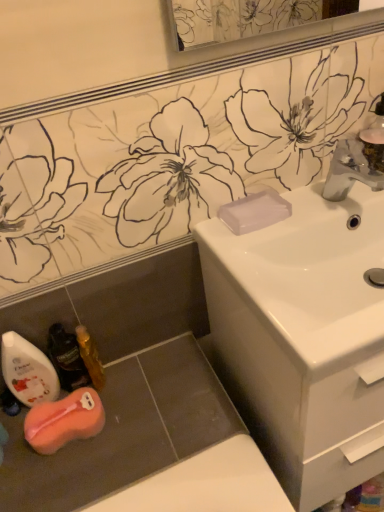
Locate an element on the screen. orange sponge at lower left is located at coordinates (64, 421).

Measure the distance between point (350, 185) and camera.

A distance of 35.08 inches exists between point (350, 185) and camera.

Describe the element at coordinates (90, 357) in the screenshot. This screenshot has width=384, height=512. I see `gold metallic mouthwash at lower left, which ranks as the first mouthwash in right-to-left order` at that location.

This screenshot has width=384, height=512. What do you see at coordinates (255, 211) in the screenshot?
I see `transparent plastic soap at sink right` at bounding box center [255, 211].

The image size is (384, 512). Describe the element at coordinates (67, 358) in the screenshot. I see `translucent plastic mouthwash at lower left, marked as the 2th mouthwash in a left-to-right arrangement` at that location.

In order to click on translucent plastic mouthwash at lower left, marked as the 2th mouthwash in a left-to-right arrangement in this screenshot , I will do `click(67, 358)`.

What are the coordinates of `orange sponge at lower left` in the screenshot? It's located at (64, 421).

In the scene shown: Are satin nickel faucet at upper right and orange sponge at lower left making contact?

No, satin nickel faucet at upper right is not beside orange sponge at lower left.

Would you say satin nickel faucet at upper right is inside or outside orange sponge at lower left?

satin nickel faucet at upper right cannot be found inside orange sponge at lower left.

Which object is further away from the camera, satin nickel faucet at upper right or orange sponge at lower left?

orange sponge at lower left is more distant.

Consider the image. Is gold metallic mouthwash at lower left, which is counted as the third mouthwash, starting from the left, inside the boundaries of white glossy sink at center, or outside?

gold metallic mouthwash at lower left, which is counted as the third mouthwash, starting from the left, is not inside white glossy sink at center, it's outside.

Is gold metallic mouthwash at lower left, which ranks as the first mouthwash in right-to-left order, oriented towards white glossy sink at center?

No, gold metallic mouthwash at lower left, which ranks as the first mouthwash in right-to-left order, does not turn towards white glossy sink at center.

Is gold metallic mouthwash at lower left, which is counted as the third mouthwash, starting from the left, further to camera compared to white glossy sink at center?

Yes.

Which is more to the right, orange sponge at lower left or transparent plastic soap at sink right?

transparent plastic soap at sink right is more to the right.

Between orange sponge at lower left and transparent plastic soap at sink right, which one has less height?

transparent plastic soap at sink right.

Is orange sponge at lower left wider than transparent plastic soap at sink right?

Yes.

From a real-world perspective, between white glossy mouthwash at lower left, the third mouthwash positioned from the right, and white glossy sink at center, who is vertically higher?

white glossy mouthwash at lower left, the third mouthwash positioned from the right, is physically above.

Looking at this image, in the image, is white glossy mouthwash at lower left, the third mouthwash positioned from the right, positioned in front of or behind white glossy sink at center?

In the image, white glossy mouthwash at lower left, the third mouthwash positioned from the right, appears behind white glossy sink at center.

Which of these two, white glossy mouthwash at lower left, the 1th mouthwash positioned from the left, or white glossy sink at center, is bigger?

white glossy sink at center is bigger.

Identify the location of mouthwash that is the 2nd one when counting backward from the satin nickel faucet at upper right. click(67, 358).

Relative to satin nickel faucet at upper right, is translucent plastic mouthwash at lower left, positioned as the 2th mouthwash in right-to-left order, in front or behind?

Clearly, translucent plastic mouthwash at lower left, positioned as the 2th mouthwash in right-to-left order, is behind satin nickel faucet at upper right.

Considering the sizes of objects translucent plastic mouthwash at lower left, positioned as the 2th mouthwash in right-to-left order, and satin nickel faucet at upper right in the image provided, who is wider, translucent plastic mouthwash at lower left, positioned as the 2th mouthwash in right-to-left order, or satin nickel faucet at upper right?

satin nickel faucet at upper right.

Based on the photo, who is shorter, gold metallic mouthwash at lower left, which ranks as the first mouthwash in right-to-left order, or translucent plastic mouthwash at lower left, marked as the 2th mouthwash in a left-to-right arrangement?

With less height is gold metallic mouthwash at lower left, which ranks as the first mouthwash in right-to-left order.

Where is `mouthwash located above the translucent plastic mouthwash at lower left, marked as the 2th mouthwash in a left-to-right arrangement (from the image's perspective)`? The width and height of the screenshot is (384, 512). mouthwash located above the translucent plastic mouthwash at lower left, marked as the 2th mouthwash in a left-to-right arrangement (from the image's perspective) is located at coordinates (90, 357).

In the scene shown: Can you see gold metallic mouthwash at lower left, which is counted as the third mouthwash, starting from the left, touching translucent plastic mouthwash at lower left, positioned as the 2th mouthwash in right-to-left order?

Yes, gold metallic mouthwash at lower left, which is counted as the third mouthwash, starting from the left, is beside translucent plastic mouthwash at lower left, positioned as the 2th mouthwash in right-to-left order.

Which is behind, point (86, 334) or point (65, 367)?

The point (86, 334) is farther.

Considering the relative sizes of satin nickel faucet at upper right and translucent plastic mouthwash at lower left, marked as the 2th mouthwash in a left-to-right arrangement, in the image provided, is satin nickel faucet at upper right bigger than translucent plastic mouthwash at lower left, marked as the 2th mouthwash in a left-to-right arrangement,?

Yes.

Which object is wider, satin nickel faucet at upper right or translucent plastic mouthwash at lower left, positioned as the 2th mouthwash in right-to-left order?

satin nickel faucet at upper right is wider.

How much distance is there between satin nickel faucet at upper right and translucent plastic mouthwash at lower left, marked as the 2th mouthwash in a left-to-right arrangement?

The distance of satin nickel faucet at upper right from translucent plastic mouthwash at lower left, marked as the 2th mouthwash in a left-to-right arrangement, is 27.08 inches.

Looking at this image, can you confirm if satin nickel faucet at upper right is positioned to the right of translucent plastic mouthwash at lower left, marked as the 2th mouthwash in a left-to-right arrangement?

Yes, satin nickel faucet at upper right is to the right of translucent plastic mouthwash at lower left, marked as the 2th mouthwash in a left-to-right arrangement.

At what (x,y) coordinates should I click in order to perform the action: click on tap in front of the orange sponge at lower left. Please return your answer as a coordinate pair (x, y). Image resolution: width=384 pixels, height=512 pixels. Looking at the image, I should click on (354, 167).

Identify the location of the 3rd mouthwash behind the white glossy sink at center. The height and width of the screenshot is (512, 384). (90, 357).

When comparing their distances from gold metallic mouthwash at lower left, which is counted as the third mouthwash, starting from the left, does satin nickel faucet at upper right or white glossy sink at center seem closer?

Based on the image, white glossy sink at center appears to be nearer to gold metallic mouthwash at lower left, which is counted as the third mouthwash, starting from the left.

When comparing their distances from orange sponge at lower left, does gold metallic mouthwash at lower left, which ranks as the first mouthwash in right-to-left order, or transparent plastic soap at sink right seem closer?

gold metallic mouthwash at lower left, which ranks as the first mouthwash in right-to-left order, lies closer to orange sponge at lower left than the other object.

Looking at the image, which one is located closer to white glossy mouthwash at lower left, the third mouthwash positioned from the right, white glossy sink at center or gold metallic mouthwash at lower left, which ranks as the first mouthwash in right-to-left order?

The object closer to white glossy mouthwash at lower left, the third mouthwash positioned from the right, is gold metallic mouthwash at lower left, which ranks as the first mouthwash in right-to-left order.

Looking at the image, which one is located closer to white glossy sink at center, translucent plastic mouthwash at lower left, marked as the 2th mouthwash in a left-to-right arrangement, or orange sponge at lower left?

The object closer to white glossy sink at center is orange sponge at lower left.

From the image, which object appears to be nearer to white glossy mouthwash at lower left, the third mouthwash positioned from the right, white glossy sink at center or orange sponge at lower left?

orange sponge at lower left.

Looking at the image, which one is located closer to translucent plastic mouthwash at lower left, marked as the 2th mouthwash in a left-to-right arrangement, gold metallic mouthwash at lower left, which is counted as the third mouthwash, starting from the left, or transparent plastic soap at sink right?

gold metallic mouthwash at lower left, which is counted as the third mouthwash, starting from the left, is closer to translucent plastic mouthwash at lower left, marked as the 2th mouthwash in a left-to-right arrangement.

Based on their spatial positions, is translucent plastic mouthwash at lower left, positioned as the 2th mouthwash in right-to-left order, or white glossy mouthwash at lower left, the 1th mouthwash positioned from the left, further from gold metallic mouthwash at lower left, which ranks as the first mouthwash in right-to-left order?

Based on the image, white glossy mouthwash at lower left, the 1th mouthwash positioned from the left, appears to be further to gold metallic mouthwash at lower left, which ranks as the first mouthwash in right-to-left order.

Based on their spatial positions, is white glossy mouthwash at lower left, the 1th mouthwash positioned from the left, or translucent plastic mouthwash at lower left, marked as the 2th mouthwash in a left-to-right arrangement, further from satin nickel faucet at upper right?

Based on the image, white glossy mouthwash at lower left, the 1th mouthwash positioned from the left, appears to be further to satin nickel faucet at upper right.

The width and height of the screenshot is (384, 512). In order to click on mouthwash between translucent plastic mouthwash at lower left, marked as the 2th mouthwash in a left-to-right arrangement, and orange sponge at lower left vertically in this screenshot , I will do `click(27, 371)`.

Where is `mouthwash situated between translucent plastic mouthwash at lower left, marked as the 2th mouthwash in a left-to-right arrangement, and transparent plastic soap at sink right from left to right`? This screenshot has height=512, width=384. mouthwash situated between translucent plastic mouthwash at lower left, marked as the 2th mouthwash in a left-to-right arrangement, and transparent plastic soap at sink right from left to right is located at coordinates (90, 357).

Locate an element on the screen. chiffonier located between translucent plastic mouthwash at lower left, marked as the 2th mouthwash in a left-to-right arrangement, and satin nickel faucet at upper right in the left-right direction is located at coordinates (64, 421).

You are a GUI agent. You are given a task and a screenshot of the screen. Output one action in this format:
    pyautogui.click(x=<x>, y=<y>)
    Task: Click on the mouthwash between orange sponge at lower left and white glossy sink at center
    The width and height of the screenshot is (384, 512).
    Given the screenshot: What is the action you would take?
    pyautogui.click(x=90, y=357)